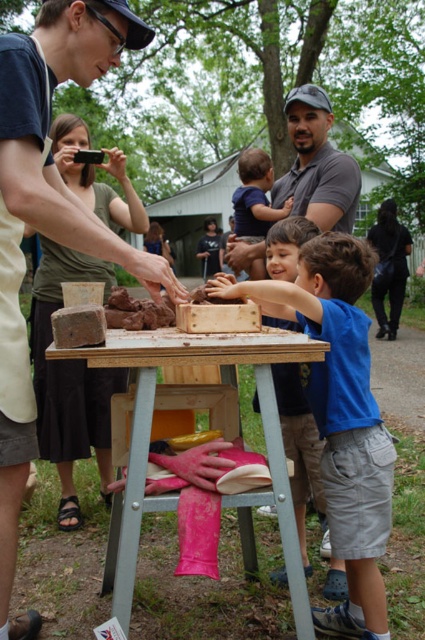
In the scene shown: Can you confirm if wooden table at center is taller than matte green shirt at upper left?

In fact, wooden table at center may be shorter than matte green shirt at upper left.

Can you confirm if wooden table at center is positioned to the left of matte green shirt at upper left?

In fact, wooden table at center is to the right of matte green shirt at upper left.

Does point (207, 342) come in front of point (61, 129)?

Yes, it is in front of point (61, 129).

This screenshot has width=425, height=640. In order to click on wooden table at center in this screenshot , I will do `click(235, 426)`.

Between matte black shirt at upper left and black leather jacket at lower right, which one has less height?

matte black shirt at upper left is shorter.

Does matte black shirt at upper left have a greater width compared to black leather jacket at lower right?

Answer: Incorrect, matte black shirt at upper left's width does not surpass black leather jacket at lower right's.

Is point (23, 374) farther from camera compared to point (391, 316)?

No, (23, 374) is closer to viewer.

Where is `matte black shirt at upper left`? This screenshot has width=425, height=640. matte black shirt at upper left is located at coordinates (48, 221).

Can you confirm if matte black shirt at upper left is thinner than matte green shirt at upper left?

Yes.

Is matte black shirt at upper left smaller than matte green shirt at upper left?

Indeed, matte black shirt at upper left has a smaller size compared to matte green shirt at upper left.

Which is in front, point (181, 292) or point (105, 164)?

Point (181, 292)

Where is `matte black shirt at upper left`? The image size is (425, 640). matte black shirt at upper left is located at coordinates (48, 221).